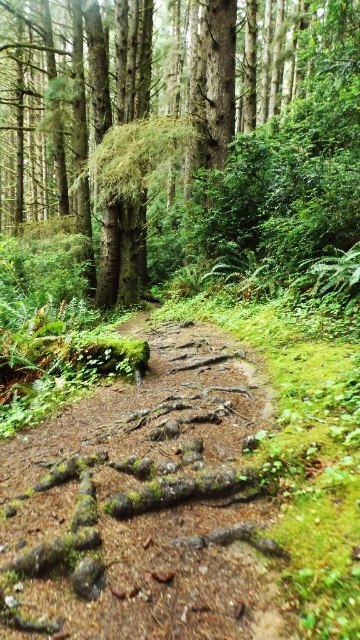
You are a hiker standing on the mossy dirt path at center. You want to reach the green mossy tree at center. Which direction should you move to get closer to the tree?

The green mossy tree at center is further to the viewer than the mossy dirt path at center, so you should move forward along the mossy dirt path at center to get closer to the tree.

You are a hiker who wants to take a photo of the green mossy tree at center and the mossy dirt path at center. Which object should you focus your camera on first if you want to capture both in a single frame without moving the camera?

The green mossy tree at center is much taller than the mossy dirt path at center, so you should focus on the green mossy tree at center first to ensure it fits entirely within the frame.